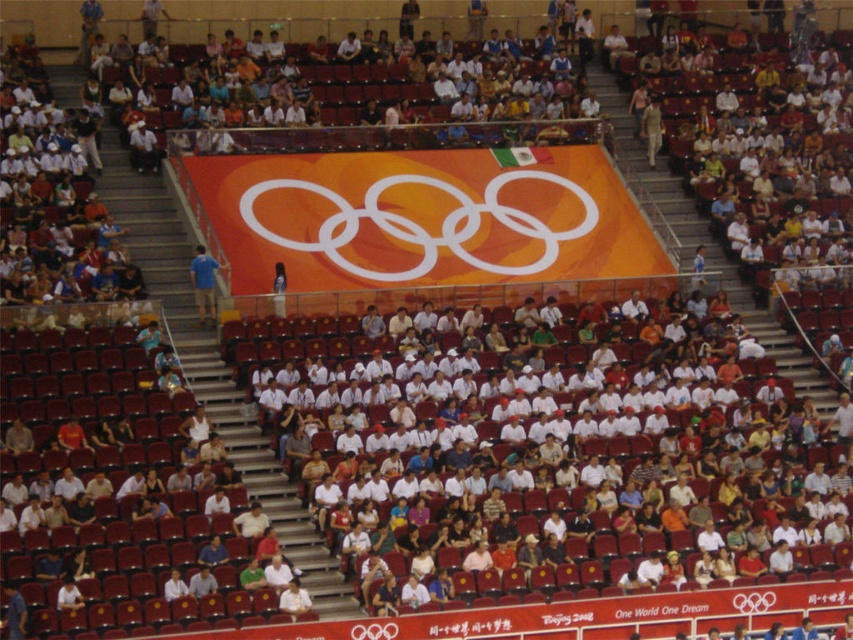
You are a photographer at the Olympic event and want to capture both the blue fabric shirt at center and the light brown leather jacket at upper right in a single shot. Which object should you focus on first to ensure both are in frame?

The blue fabric shirt at center is taller than the light brown leather jacket at upper right, so you should focus on the blue fabric shirt at center first to ensure both are in frame.

You are a photographer trying to capture a photo of the Olympic rings display. You notice a blue fabric shirt at center and a light brown leather jacket at upper right in your frame. Which clothing item should you adjust your focus to ensure it doesn not block the Olympic rings?

The blue fabric shirt at center is bigger than the light brown leather jacket at upper right, so you should adjust your focus to avoid the blue fabric shirt at center as it is larger and more likely to obstruct the Olympic rings display.

You are an athlete standing at the center of the Olympic rings display in the stadium. You notice a blue fabric shirt at center. Where is the point with coordinates point (204, 284) located?

The point with coordinates point (204, 284) is located on the blue fabric shirt at center.